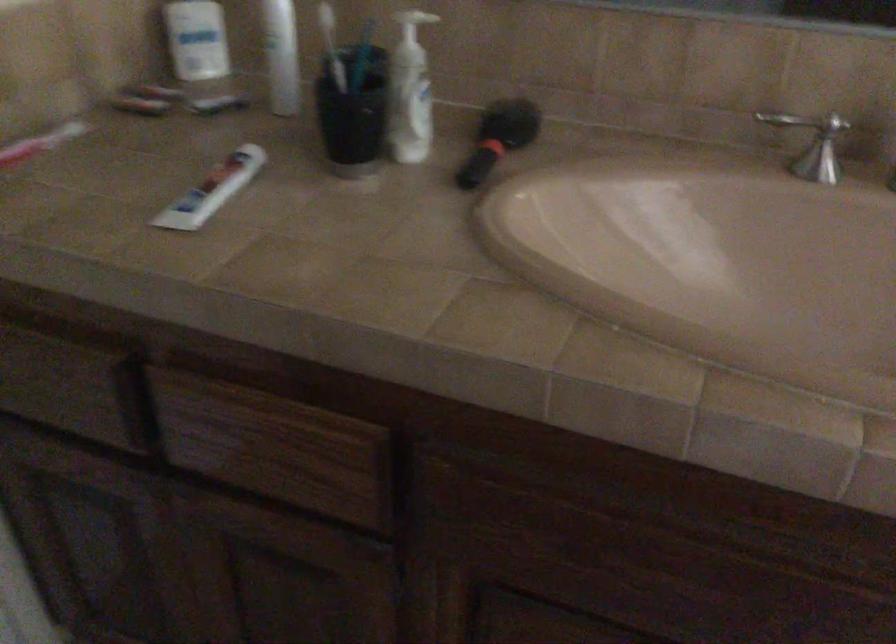
Describe the element at coordinates (821, 153) in the screenshot. I see `the silver faucet handle` at that location.